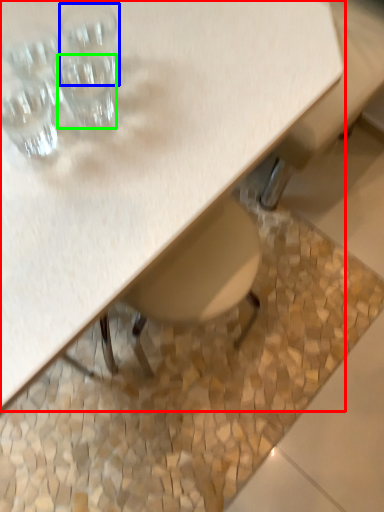
Question: Estimate the real-world distances between objects in this image. Which object is farther from table (highlighted by a red box), shot glass (highlighted by a blue box) or shot glass (highlighted by a green box)?

Choices:
 (A) shot glass
 (B) shot glass

Answer: (A)